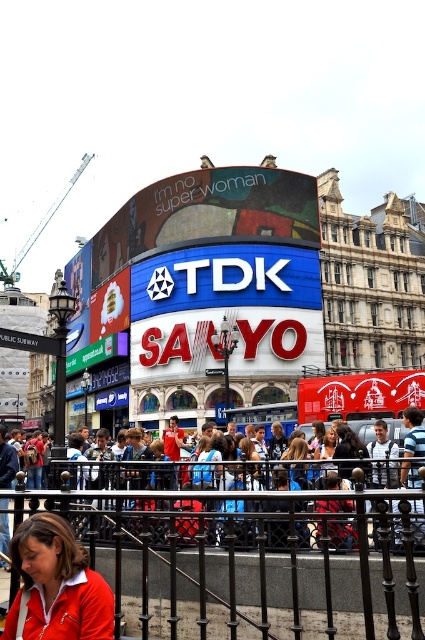
You are a photographer trying to capture a clear shot of the blue denim jeans at lower center and the matte black hair at center. Which object should you focus on first if you want to ensure both are in focus without adjusting the camera settings?

The blue denim jeans at lower center is below matte black hair at center, so you should focus on the matte black hair at center first since it is closer to the camera. This way, the depth of field will likely include both objects in focus.

You are standing at Piccadilly Circus in London and want to reach a specific location marked by the point at coordinates [223,531]. If you can walk 5 meters per minute, how many minutes will it take you to reach that point?

The distance between you and the point at [223,531] is 40.25 meters. At a walking speed of 5 meters per minute, it would take 8.05 minutes to reach the point.